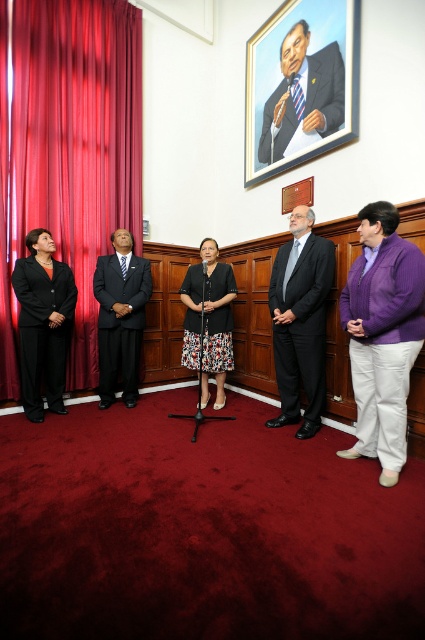
Is point (320, 384) positioned in front of point (220, 310)?

That is True.

This screenshot has width=425, height=640. Identify the location of black satin suit at center. (302, 324).

Is the position of black matte suit at left more distant than that of dark gray suit at center?

No, black matte suit at left is closer to the viewer.

Who is taller, black matte suit at left or dark gray suit at center?

dark gray suit at center is taller.

This screenshot has height=640, width=425. What do you see at coordinates (42, 332) in the screenshot?
I see `black matte suit at left` at bounding box center [42, 332].

Where is `black matte suit at left`? This screenshot has height=640, width=425. black matte suit at left is located at coordinates (42, 332).

How much distance is there between purple fleece jacket at right and black satin suit at center?

purple fleece jacket at right is 23.29 inches from black satin suit at center.

Is point (408, 324) closer to camera compared to point (316, 408)?

That is True.

The width and height of the screenshot is (425, 640). What do you see at coordinates (382, 336) in the screenshot?
I see `purple fleece jacket at right` at bounding box center [382, 336].

Find the location of a particular element. purple fleece jacket at right is located at coordinates (382, 336).